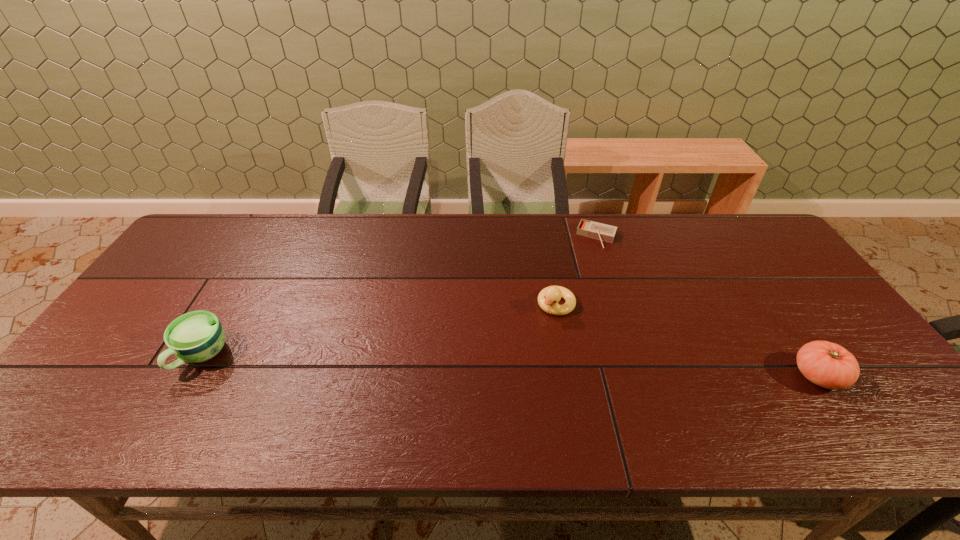
You are a GUI agent. You are given a task and a screenshot of the screen. Output one action in this format:
    pyautogui.click(x=<x>, y=<y>)
    Task: Click on the vacant space located 0.060m on the striking surface of the farthest object
    The width and height of the screenshot is (960, 540).
    Given the screenshot: What is the action you would take?
    pyautogui.click(x=588, y=259)

Where is `blank space located at the beak of the third nearest object`? The height and width of the screenshot is (540, 960). blank space located at the beak of the third nearest object is located at coordinates click(x=489, y=388).

Where is `blank area located 0.190m at the beak of the third nearest object`? blank area located 0.190m at the beak of the third nearest object is located at coordinates 510,363.

Where is `vacant area situated 0.050m at the beak of the third nearest object`? vacant area situated 0.050m at the beak of the third nearest object is located at coordinates (538, 328).

At what (x,y) coordinates should I click in order to perform the action: click on object present at the far edge. Please return your answer as a coordinate pair (x, y). Looking at the image, I should click on (591, 229).

Where is `cup at the near edge`? The image size is (960, 540). cup at the near edge is located at coordinates (194, 337).

Find the location of a particular element. The width and height of the screenshot is (960, 540). tomato that is at the near edge is located at coordinates (829, 365).

Find the location of a particular element. This screenshot has height=540, width=960. object that is at the right edge is located at coordinates (829, 365).

This screenshot has height=540, width=960. Identify the location of object that is at the near right corner. (829, 365).

Identify the location of vacant space at the far edge of the desktop. The image size is (960, 540). (530, 216).